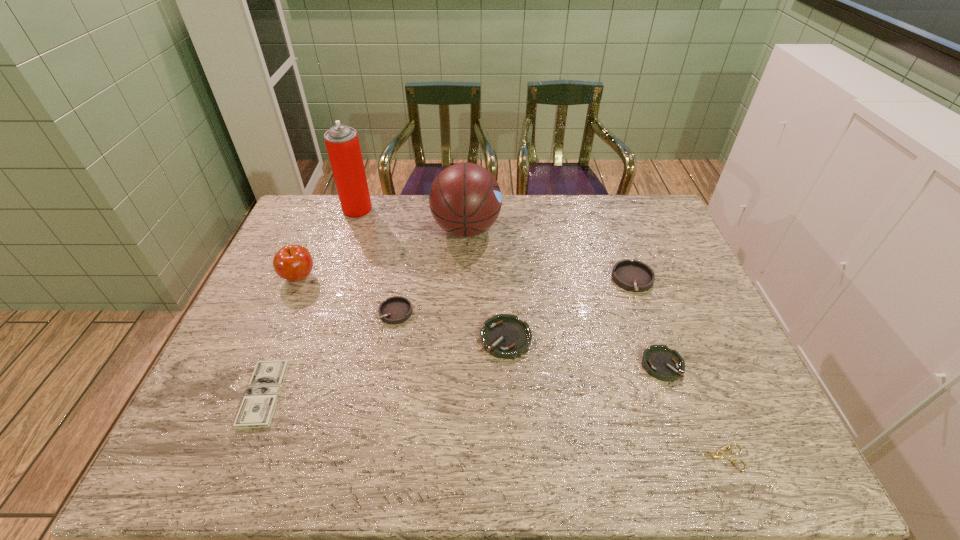
You are a GUI agent. You are given a task and a screenshot of the screen. Output one action in this format:
    pyautogui.click(x=<x>, y=<y>)
    Task: Click on the vacant space located on the front of the bigger green ashtray
    This screenshot has width=960, height=540.
    Given the screenshot: What is the action you would take?
    pyautogui.click(x=511, y=434)

Locate an element on the screen. The width and height of the screenshot is (960, 540). vacant area situated 0.200m on the back of the shortest ashtray is located at coordinates point(636,293).

Find the location of `free location located on the right of the second shortest object`. free location located on the right of the second shortest object is located at coordinates (345, 394).

The width and height of the screenshot is (960, 540). Find the location of `free space located 0.110m on the back of the shears`. free space located 0.110m on the back of the shears is located at coordinates click(695, 399).

The width and height of the screenshot is (960, 540). In order to click on aerosol can that is at the far edge in this screenshot , I will do `click(342, 143)`.

This screenshot has width=960, height=540. In order to click on basketball situated at the far edge in this screenshot , I will do `click(465, 199)`.

Image resolution: width=960 pixels, height=540 pixels. Find the location of `object at the near edge`. object at the near edge is located at coordinates (718, 455).

The height and width of the screenshot is (540, 960). I want to click on aerosol can located in the left edge section of the desktop, so click(342, 143).

You are a GUI agent. You are given a task and a screenshot of the screen. Output one action in this format:
    pyautogui.click(x=<x>, y=<y>)
    Task: Click on the apple that is at the left edge
    This screenshot has height=540, width=960.
    Given the screenshot: What is the action you would take?
    pyautogui.click(x=294, y=263)

Identify the location of dollar that is at the left edge. This screenshot has height=540, width=960. (x=259, y=402).